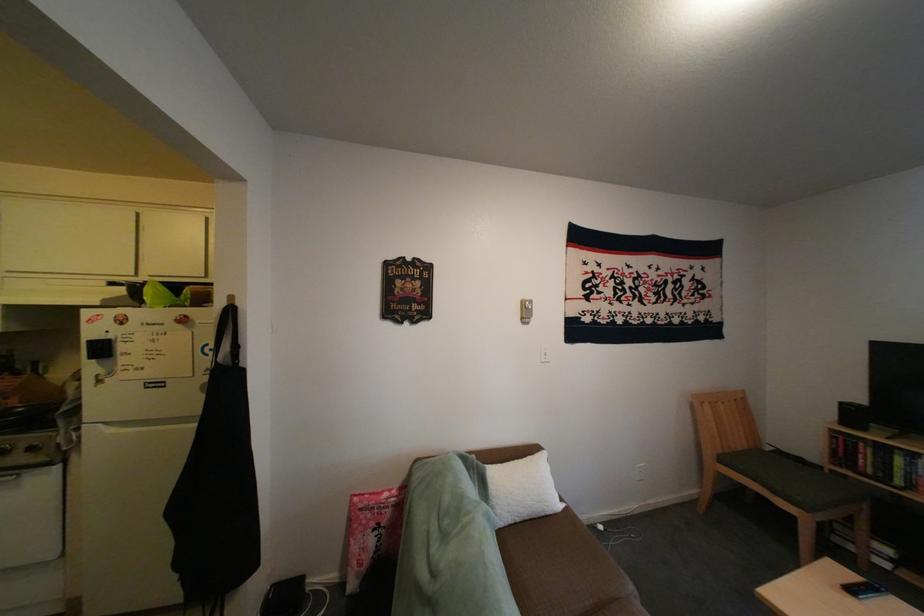
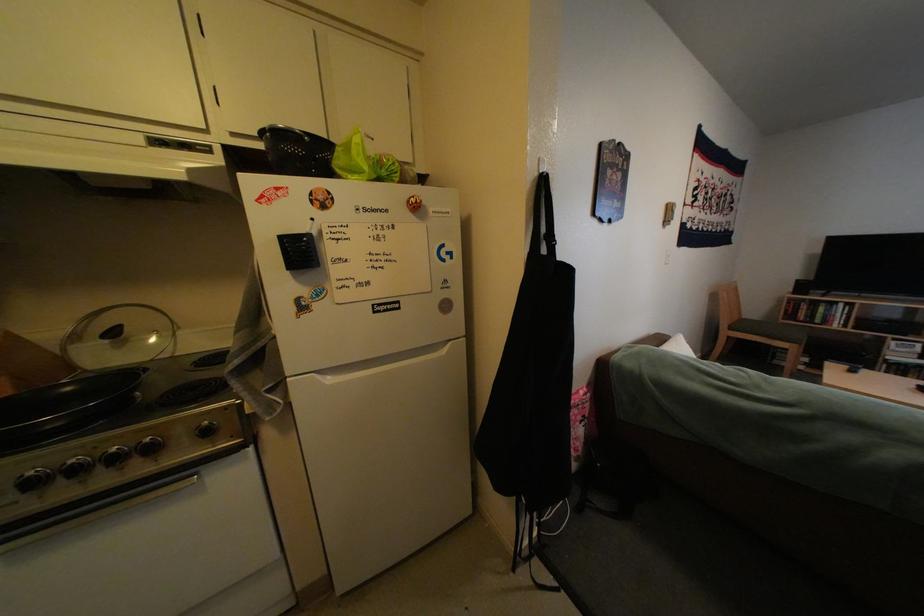
Locate, in the second image, the point that corresponds to pixel 869 416 in the first image.

(816, 288)